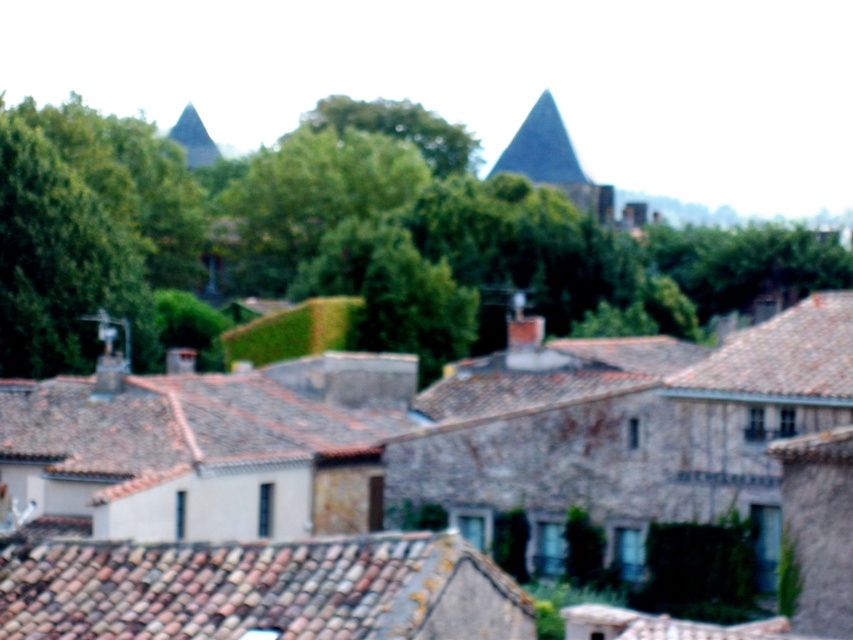
Question: Can you confirm if brown tile roof at lower center is wider than dark gray stone roof at upper center?

Choices:
 (A) no
 (B) yes

Answer: (B)

Question: Which point is closer to the camera?

Choices:
 (A) (355, 593)
 (B) (759, 365)
 (C) (576, 180)

Answer: (A)

Question: Observing the image, what is the correct spatial positioning of brown tile roof at lower center in reference to dark gray stone roof at upper center?

Choices:
 (A) above
 (B) below

Answer: (B)

Question: Among these objects, which one is farthest from the camera?

Choices:
 (A) dark gray stone roof at upper center
 (B) brown tile roof at lower center

Answer: (A)

Question: Considering the real-world distances, which object is closest to the brown tile roof at upper right?

Choices:
 (A) dark gray stone roof at upper center
 (B) brown tile roof at lower center

Answer: (B)

Question: From the image, what is the correct spatial relationship of brown tile roof at lower center in relation to brown tile roof at upper right?

Choices:
 (A) above
 (B) below

Answer: (B)